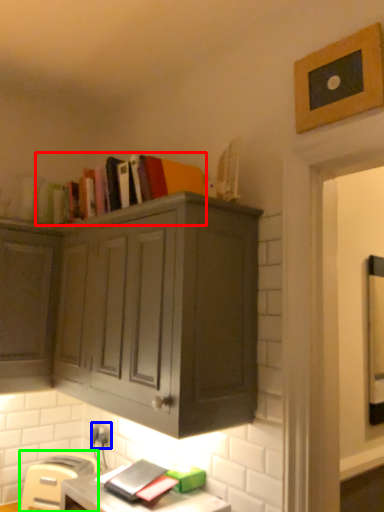
Question: Which is farther away from book (highlighted by a red box)? electric outlet (highlighted by a blue box) or chair (highlighted by a green box)?

Choices:
 (A) electric outlet
 (B) chair

Answer: (B)